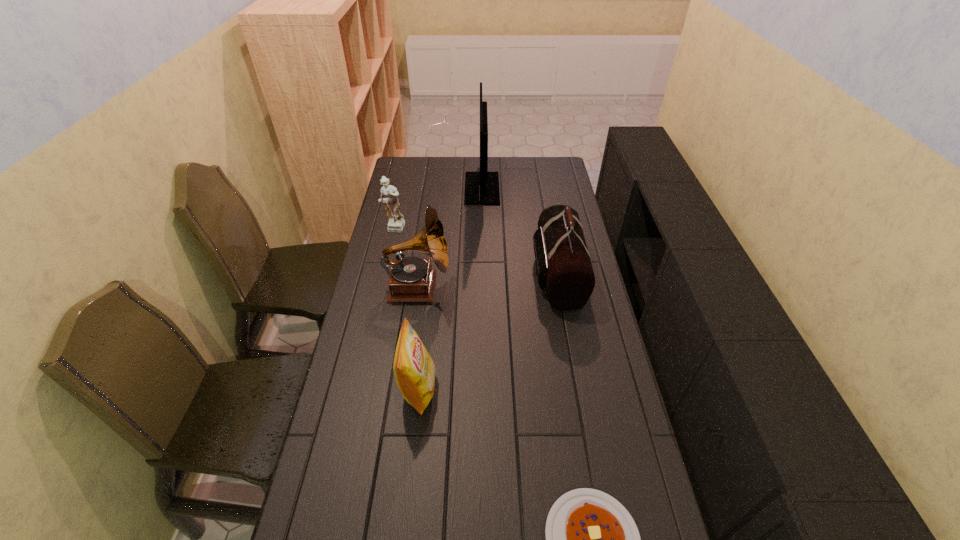
In order to click on the fourth object from left to right in this screenshot , I will do `click(481, 188)`.

This screenshot has width=960, height=540. What are the coordinates of `monitor` in the screenshot? It's located at (x=481, y=188).

Where is `the fifth shortest object`? Image resolution: width=960 pixels, height=540 pixels. the fifth shortest object is located at coordinates pyautogui.click(x=411, y=279).

This screenshot has height=540, width=960. In order to click on duffel bag in this screenshot , I will do `click(563, 266)`.

Where is `the second farthest object`? This screenshot has width=960, height=540. the second farthest object is located at coordinates (396, 224).

Image resolution: width=960 pixels, height=540 pixels. I want to click on crisp (potato chip), so click(414, 370).

Find the location of a particular element. This screenshot has width=960, height=540. vacant space situated on the screen side of the tallest object is located at coordinates (400, 188).

Find the location of a particular element. This screenshot has width=960, height=540. vacant space located on the screen side of the tallest object is located at coordinates (446, 188).

In order to click on vacant space located on the screen side of the tallest object in this screenshot , I will do `click(420, 188)`.

At what (x,y) coordinates should I click in order to perform the action: click on free space located 0.210m on the horn of the phonograph_record. Please return your answer as a coordinate pair (x, y). Looking at the image, I should click on (507, 287).